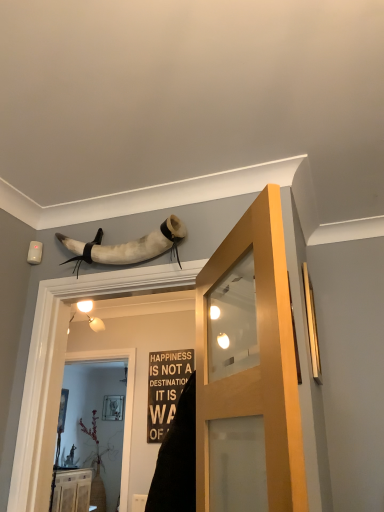
Question: From a real-world perspective, is translucent glass screen door at center under gold metallic window at right?

Choices:
 (A) no
 (B) yes

Answer: (B)

Question: Is translucent glass screen door at center facing away from gold metallic window at right?

Choices:
 (A) yes
 (B) no

Answer: (B)

Question: From the image's perspective, would you say translucent glass screen door at center is positioned over gold metallic window at right?

Choices:
 (A) yes
 (B) no

Answer: (B)

Question: Is translucent glass screen door at center taller than gold metallic window at right?

Choices:
 (A) yes
 (B) no

Answer: (A)

Question: Is translucent glass screen door at center aimed at gold metallic window at right?

Choices:
 (A) yes
 (B) no

Answer: (B)

Question: Is translucent glass screen door at center far from gold metallic window at right?

Choices:
 (A) no
 (B) yes

Answer: (B)

Question: Would you consider matte wood door at center to be distant from translucent glass screen door at center?

Choices:
 (A) yes
 (B) no

Answer: (A)

Question: Is matte wood door at center at the left side of translucent glass screen door at center?

Choices:
 (A) no
 (B) yes

Answer: (A)

Question: Does matte wood door at center have a lesser height compared to translucent glass screen door at center?

Choices:
 (A) yes
 (B) no

Answer: (A)

Question: Does matte wood door at center have a lesser width compared to translucent glass screen door at center?

Choices:
 (A) no
 (B) yes

Answer: (A)

Question: From the image's perspective, would you say matte wood door at center is shown under translucent glass screen door at center?

Choices:
 (A) yes
 (B) no

Answer: (B)

Question: Does matte wood door at center have a larger size compared to translucent glass screen door at center?

Choices:
 (A) yes
 (B) no

Answer: (A)

Question: Considering the relative sizes of gold metallic window at right and translucent glass screen door at center in the image provided, is gold metallic window at right smaller than translucent glass screen door at center?

Choices:
 (A) no
 (B) yes

Answer: (B)